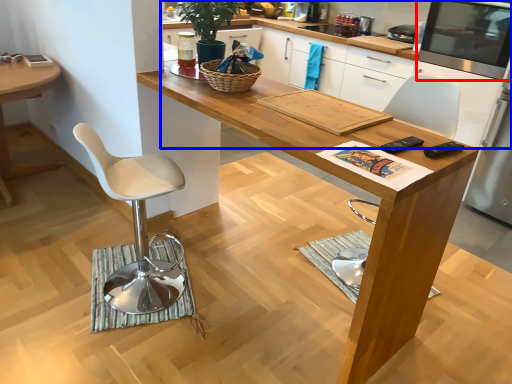
Question: Which object appears closest to the camera in this image, appliance (highlighted by a red box) or cabinetry (highlighted by a blue box)?

Choices:
 (A) appliance
 (B) cabinetry

Answer: (A)